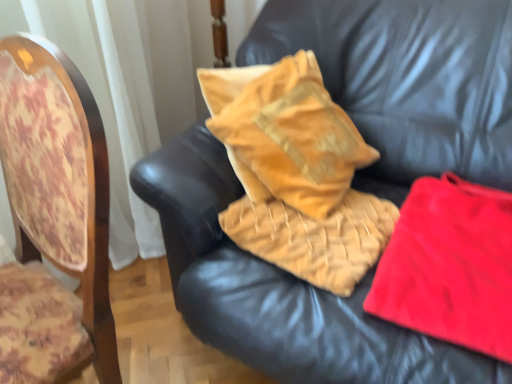
What are the coordinates of `velvet orange pillow at upper center` in the screenshot? It's located at (407, 81).

Describe the element at coordinates (315, 237) in the screenshot. This screenshot has width=512, height=384. I see `velvet gold pillow at center, placed as the first material when sorted from left to right` at that location.

Find the location of `wooden chair back at left`. wooden chair back at left is located at coordinates (53, 219).

Is point (496, 224) closer or farther from the camera than point (55, 81)?

Point (496, 224) appears to be farther away from the viewer than point (55, 81).

What's the angular difference between red fleece blanket at right, the 1th material viewed from the right, and wooden chair back at left's facing directions?

The angle between the facing direction of red fleece blanket at right, the 1th material viewed from the right, and the facing direction of wooden chair back at left is 8.31 degrees.

This screenshot has width=512, height=384. Identify the location of the 2nd material below the wooden chair back at left (from a real-world perspective). (450, 266).

Does red fleece blanket at right, which is the 2th material from left to right, have a lesser height compared to wooden chair back at left?

Yes.

Is velvet/yellow pillow at center far from red fleece blanket at right, the 1th material viewed from the right?

velvet/yellow pillow at center is near red fleece blanket at right, the 1th material viewed from the right, not far away.

Could you tell me if velvet/yellow pillow at center is facing red fleece blanket at right, which is the 2th material from left to right?

Yes, velvet/yellow pillow at center is facing red fleece blanket at right, which is the 2th material from left to right.

How far apart are velvet/yellow pillow at center and red fleece blanket at right, which is the 2th material from left to right?

A distance of 12.98 inches exists between velvet/yellow pillow at center and red fleece blanket at right, which is the 2th material from left to right.

Can you tell me how much velvet/yellow pillow at center and red fleece blanket at right, the 1th material viewed from the right, differ in facing direction?

66.1 degrees.

Is red fleece blanket at right, the 1th material viewed from the right, turned away from velvet gold pillow at center, the second material when ordered from right to left?

red fleece blanket at right, the 1th material viewed from the right, is not turned away from velvet gold pillow at center, the second material when ordered from right to left.

Is red fleece blanket at right, the 1th material viewed from the right, wider or thinner than velvet gold pillow at center, placed as the first material when sorted from left to right?

In the image, red fleece blanket at right, the 1th material viewed from the right, appears to be wider than velvet gold pillow at center, placed as the first material when sorted from left to right.

Is red fleece blanket at right, which is the 2th material from left to right, smaller than velvet gold pillow at center, the second material when ordered from right to left?

Incorrect, red fleece blanket at right, which is the 2th material from left to right, is not smaller in size than velvet gold pillow at center, the second material when ordered from right to left.

Does red fleece blanket at right, which is the 2th material from left to right, have a greater height compared to velvet gold pillow at center, the second material when ordered from right to left?

No, red fleece blanket at right, which is the 2th material from left to right, is not taller than velvet gold pillow at center, the second material when ordered from right to left.

Find the location of a particular element. This screenshot has height=384, width=512. furniture that appears on the right of wooden chair back at left is located at coordinates (407, 81).

Is wooden chair back at left oriented away from velvet orange pillow at upper center?

Yes, wooden chair back at left's orientation is away from velvet orange pillow at upper center.

Which is more distant, (13, 276) or (327, 60)?

The point (327, 60) is behind.

Which object is thinner, wooden chair back at left or velvet orange pillow at upper center?

With smaller width is wooden chair back at left.

Is there a large distance between wooden chair back at left and velvet/yellow pillow at center?

That's not correct — wooden chair back at left is a little close to velvet/yellow pillow at center.

Considering the relative sizes of wooden chair back at left and velvet/yellow pillow at center in the image provided, is wooden chair back at left thinner than velvet/yellow pillow at center?

Incorrect, the width of wooden chair back at left is not less than that of velvet/yellow pillow at center.

Is point (61, 356) positioned after point (354, 146)?

No, it is not.

From a real-world perspective, which object rests below the other?

In real-world perspective, red fleece blanket at right, the 1th material viewed from the right, is lower.

Would you say wooden chair back at left is to the left or to the right of red fleece blanket at right, which is the 2th material from left to right, in the picture?

From the image, it's evident that wooden chair back at left is to the left of red fleece blanket at right, which is the 2th material from left to right.

Is point (88, 109) closer to viewer compared to point (446, 319)?

Yes, it is in front of point (446, 319).

Would you say red fleece blanket at right, the 1th material viewed from the right, is part of wooden chair back at left's contents?

No, red fleece blanket at right, the 1th material viewed from the right, is not inside wooden chair back at left.

Is red fleece blanket at right, which is the 2th material from left to right, at the left side of velvet/yellow pillow at center?

Answer: Incorrect, red fleece blanket at right, which is the 2th material from left to right, is not on the left side of velvet/yellow pillow at center.

Which is behind, point (440, 302) or point (345, 180)?

Point (345, 180)

Looking at their sizes, would you say red fleece blanket at right, the 1th material viewed from the right, is wider or thinner than velvet/yellow pillow at center?

Considering their sizes, red fleece blanket at right, the 1th material viewed from the right, looks broader than velvet/yellow pillow at center.

From the image's perspective, count 1st materials upward from the wooden chair back at left and point to it. Please provide its 2D coordinates.

[(450, 266)]

Locate an element on the screen. This screenshot has height=384, width=512. the 2nd material in front when counting from the velvet/yellow pillow at center is located at coordinates (450, 266).

Considering their positions, is red fleece blanket at right, the 1th material viewed from the right, positioned further to velvet gold pillow at center, placed as the first material when sorted from left to right, than velvet orange pillow at upper center?

velvet orange pillow at upper center.

From the image, which object appears to be farther from velvet gold pillow at center, placed as the first material when sorted from left to right, velvet orange pillow at upper center or red fleece blanket at right, which is the 2th material from left to right?

velvet orange pillow at upper center lies further to velvet gold pillow at center, placed as the first material when sorted from left to right, than the other object.

From the image, which object appears to be farther from velvet orange pillow at upper center, red fleece blanket at right, which is the 2th material from left to right, or velvet gold pillow at center, the second material when ordered from right to left?

velvet gold pillow at center, the second material when ordered from right to left, is positioned further to the anchor velvet orange pillow at upper center.

From the picture: Which object lies nearer to the anchor point velvet gold pillow at center, the second material when ordered from right to left, wooden chair back at left or velvet orange pillow at upper center?

velvet orange pillow at upper center is positioned closer to the anchor velvet gold pillow at center, the second material when ordered from right to left.

Estimate the real-world distances between objects in this image. Which object is further from velvet orange pillow at upper center, wooden chair back at left or velvet gold pillow at center, the second material when ordered from right to left?

wooden chair back at left is positioned further to the anchor velvet orange pillow at upper center.

Which object lies further to the anchor point red fleece blanket at right, the 1th material viewed from the right, velvet/yellow pillow at center or velvet gold pillow at center, the second material when ordered from right to left?

The object further to red fleece blanket at right, the 1th material viewed from the right, is velvet/yellow pillow at center.

Which object lies nearer to the anchor point wooden chair back at left, velvet/yellow pillow at center or red fleece blanket at right, the 1th material viewed from the right?

Among the two, velvet/yellow pillow at center is located nearer to wooden chair back at left.

Considering their positions, is wooden chair back at left positioned closer to velvet gold pillow at center, the second material when ordered from right to left, than velvet/yellow pillow at center?

velvet/yellow pillow at center lies closer to velvet gold pillow at center, the second material when ordered from right to left, than the other object.

Find the location of a particular element. material between wooden chair back at left and velvet orange pillow at upper center is located at coordinates (315, 237).

What are the coordinates of `material between velvet orange pillow at upper center and velvet gold pillow at center, placed as the first material when sorted from left to right, along the z-axis` in the screenshot? It's located at point(450,266).

Where is `pillow situated between wooden chair back at left and velvet orange pillow at upper center from left to right`? Image resolution: width=512 pixels, height=384 pixels. pillow situated between wooden chair back at left and velvet orange pillow at upper center from left to right is located at coordinates (285, 133).

This screenshot has width=512, height=384. I want to click on furniture between wooden chair back at left and red fleece blanket at right, which is the 2th material from left to right, from left to right, so click(x=407, y=81).